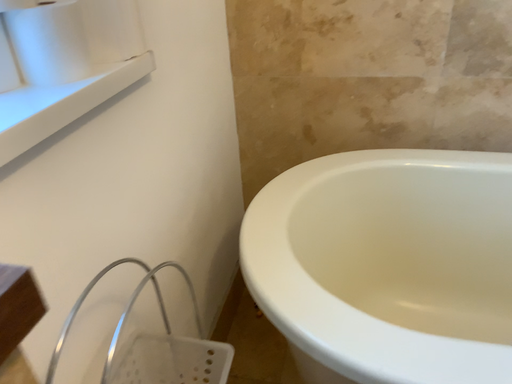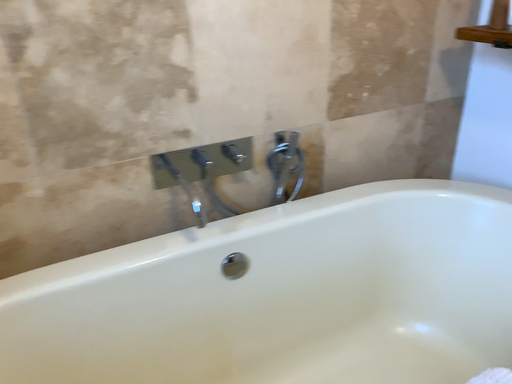
Question: Which way did the camera rotate in the video?

Choices:
 (A) rotated left
 (B) rotated right

Answer: (B)